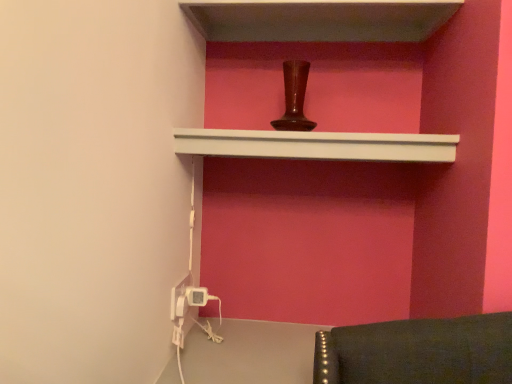
Question: Which direction should I rotate to face white matte shelf at upper center, acting as the 1th shelf starting from the bottom, — up or down?

Choices:
 (A) up
 (B) down

Answer: (A)

Question: Is white plastic electric outlet at lower left, arranged as the first electric outlet when viewed from the right, not close to white plastic electric outlet at lower left, which is the first electric outlet in left-to-right order?

Choices:
 (A) yes
 (B) no

Answer: (B)

Question: Could you tell me if white plastic electric outlet at lower left, arranged as the first electric outlet when viewed from the right, is facing white plastic electric outlet at lower left, which is the second electric outlet from right to left?

Choices:
 (A) yes
 (B) no

Answer: (B)

Question: Is white plastic electric outlet at lower left, arranged as the second electric outlet when viewed from the left, thinner than white plastic electric outlet at lower left, which is the first electric outlet in left-to-right order?

Choices:
 (A) yes
 (B) no

Answer: (B)

Question: Does white plastic electric outlet at lower left, arranged as the first electric outlet when viewed from the right, have a larger size compared to white plastic electric outlet at lower left, which is the first electric outlet in left-to-right order?

Choices:
 (A) yes
 (B) no

Answer: (A)

Question: Can you confirm if white plastic electric outlet at lower left, arranged as the first electric outlet when viewed from the right, is wider than white plastic electric outlet at lower left, which is the first electric outlet in left-to-right order?

Choices:
 (A) no
 (B) yes

Answer: (B)

Question: Is white plastic electric outlet at lower left, arranged as the first electric outlet when viewed from the right, completely or partially outside of white plastic electric outlet at lower left, which is the second electric outlet from right to left?

Choices:
 (A) yes
 (B) no

Answer: (A)

Question: Considering the relative positions of smooth white shelf at upper center, which is counted as the second shelf, starting from the bottom, and white plastic electric outlet at lower left, arranged as the second electric outlet when viewed from the left, in the image provided, is smooth white shelf at upper center, which is counted as the second shelf, starting from the bottom, to the left of white plastic electric outlet at lower left, arranged as the second electric outlet when viewed from the left, from the viewer's perspective?

Choices:
 (A) yes
 (B) no

Answer: (B)

Question: Does smooth white shelf at upper center, which ranks as the 1th shelf in top-to-bottom order, touch white plastic electric outlet at lower left, arranged as the first electric outlet when viewed from the right?

Choices:
 (A) no
 (B) yes

Answer: (A)

Question: Is smooth white shelf at upper center, which is counted as the second shelf, starting from the bottom, further to camera compared to white plastic electric outlet at lower left, arranged as the second electric outlet when viewed from the left?

Choices:
 (A) yes
 (B) no

Answer: (B)

Question: Is smooth white shelf at upper center, which ranks as the 1th shelf in top-to-bottom order, completely or partially outside of white plastic electric outlet at lower left, arranged as the second electric outlet when viewed from the left?

Choices:
 (A) no
 (B) yes

Answer: (B)

Question: From a real-world perspective, is smooth white shelf at upper center, which is counted as the second shelf, starting from the bottom, positioned over white plastic electric outlet at lower left, arranged as the first electric outlet when viewed from the right, based on gravity?

Choices:
 (A) yes
 (B) no

Answer: (A)

Question: Is smooth white shelf at upper center, which ranks as the 1th shelf in top-to-bottom order, facing towards white plastic electric outlet at lower left, arranged as the second electric outlet when viewed from the left?

Choices:
 (A) no
 (B) yes

Answer: (A)

Question: Does white plastic electric outlet at lower left, arranged as the second electric outlet when viewed from the left, have a larger size compared to smooth white shelf at upper center, which ranks as the 1th shelf in top-to-bottom order?

Choices:
 (A) yes
 (B) no

Answer: (B)